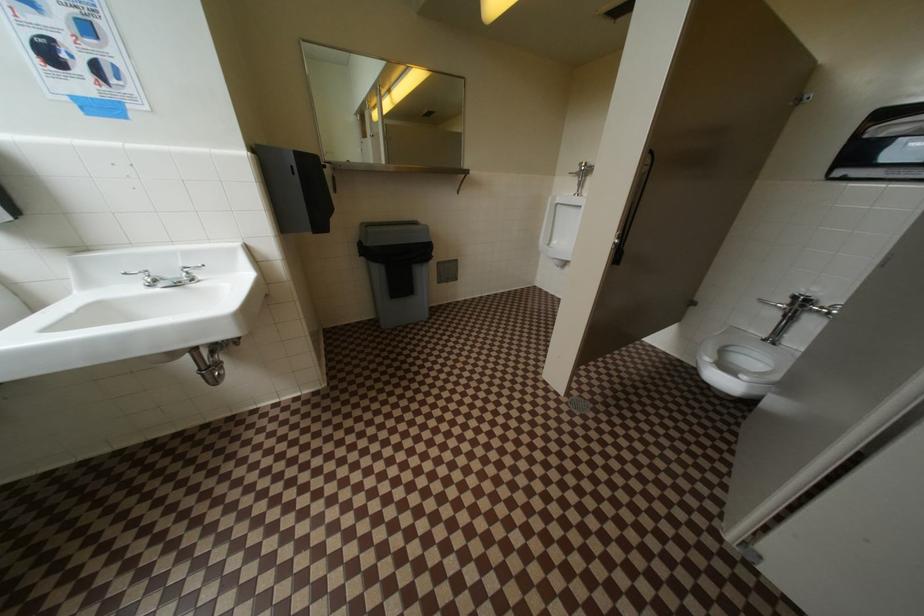
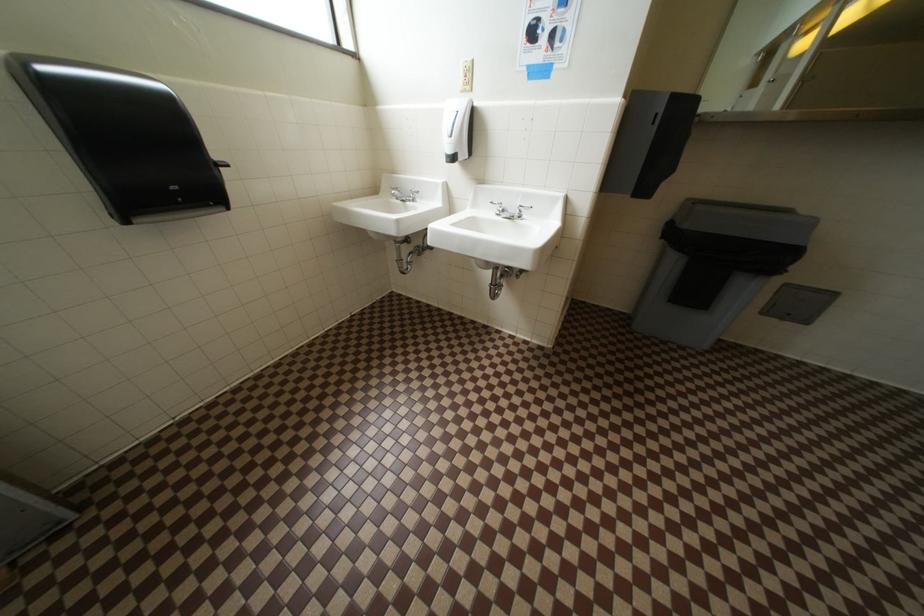
First-person continuous shooting, in which direction is the camera rotating?

The camera's rotation is toward left-down.